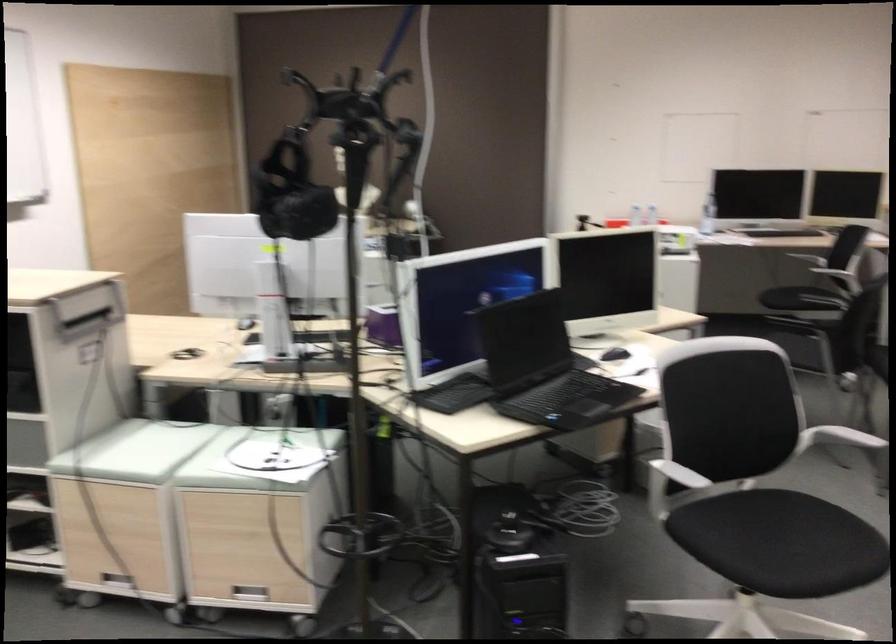
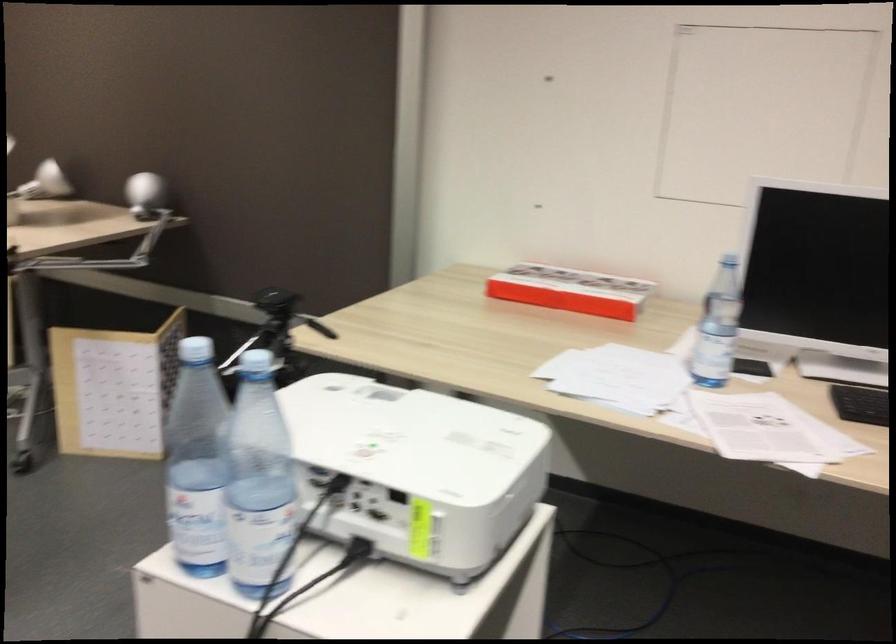
The point at [659,203] is marked in the first image. Where is the corresponding point in the second image?

(570, 290)